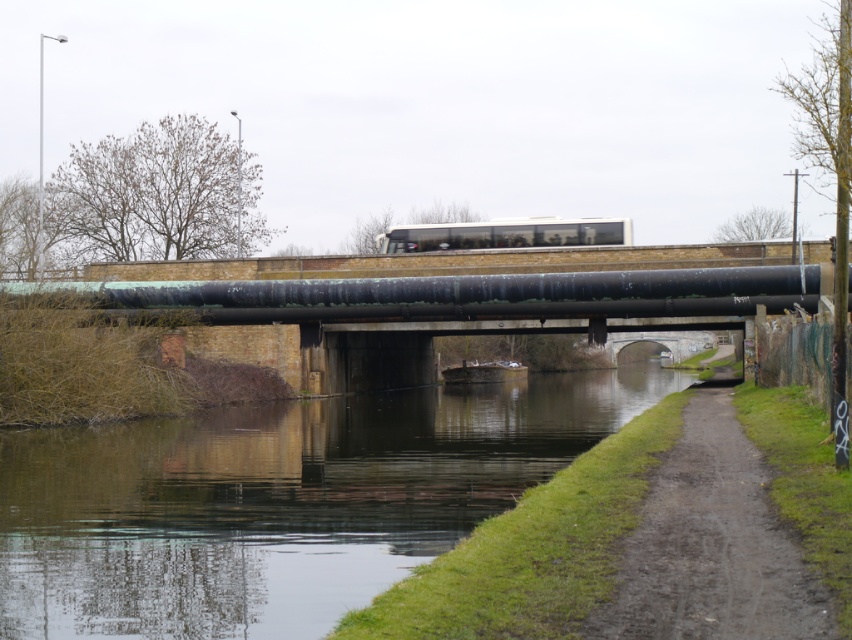
Which is more to the right, greenish-brown concrete bridge at center or dirt/gravel path at lower right?

dirt/gravel path at lower right

Find the location of `greenish-brown concrete bridge at center`. greenish-brown concrete bridge at center is located at coordinates (455, 308).

Based on the photo, who is lower down, greenish-brown concrete bridge at center or green patina pipe at center?

greenish-brown concrete bridge at center is lower down.

Does greenish-brown concrete bridge at center have a lesser height compared to green patina pipe at center?

Incorrect, greenish-brown concrete bridge at center's height does not fall short of green patina pipe at center's.

Does point (689, 310) lie behind point (766, 280)?

Yes, point (689, 310) is behind point (766, 280).

Locate an element on the screen. The width and height of the screenshot is (852, 640). greenish-brown concrete bridge at center is located at coordinates (455, 308).

Does green grassy river at lower left have a greater width compared to greenish-brown concrete bridge at center?

No.

Between point (453, 388) and point (458, 316), which one is positioned in front?

Point (458, 316) is in front.

Which is behind, point (176, 557) or point (262, 284)?

The point (262, 284) is more distant.

The height and width of the screenshot is (640, 852). In order to click on green grassy river at lower left in this screenshot , I will do 277,500.